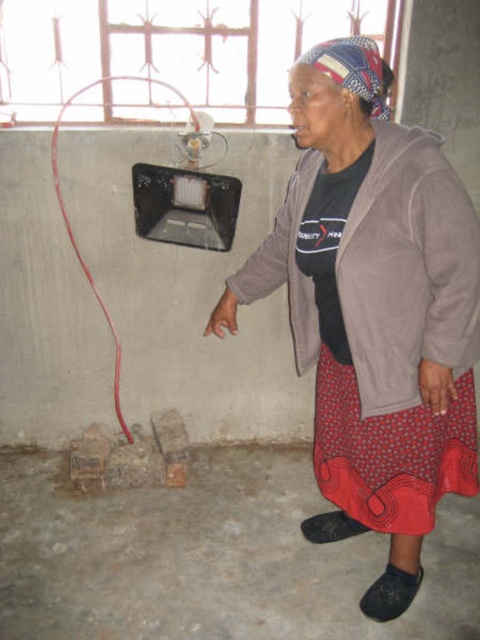
Between matte gray jacket at center and red rubber wire at left, which one has more height?

matte gray jacket at center is taller.

Is matte gray jacket at center to the left of red rubber wire at left from the viewer's perspective?

In fact, matte gray jacket at center is to the right of red rubber wire at left.

Where is `matte gray jacket at center`? This screenshot has height=640, width=480. matte gray jacket at center is located at coordinates (373, 310).

Locate an element on the screen. The width and height of the screenshot is (480, 640). matte gray jacket at center is located at coordinates (373, 310).